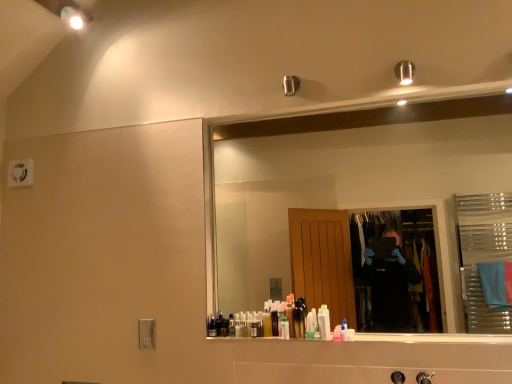
You are a GUI agent. You are given a task and a screenshot of the screen. Output one action in this format:
    pyautogui.click(x=<x>, y=<y>)
    Task: Click on the free space to the left of translucent plastic bottle at center, which is the 6th toiletry from right to left
    Image resolution: width=512 pixels, height=384 pixels.
    Given the screenshot: What is the action you would take?
    pyautogui.click(x=247, y=342)